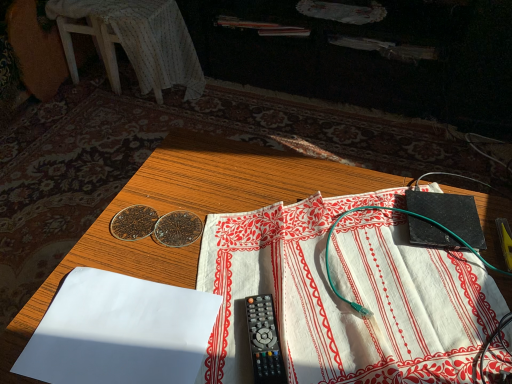
Image resolution: width=512 pixels, height=384 pixels. What are the coordinates of `free region under white paper at lower left, the 2th sheet from the right (from a real-world perspective)` in the screenshot? It's located at click(x=121, y=334).